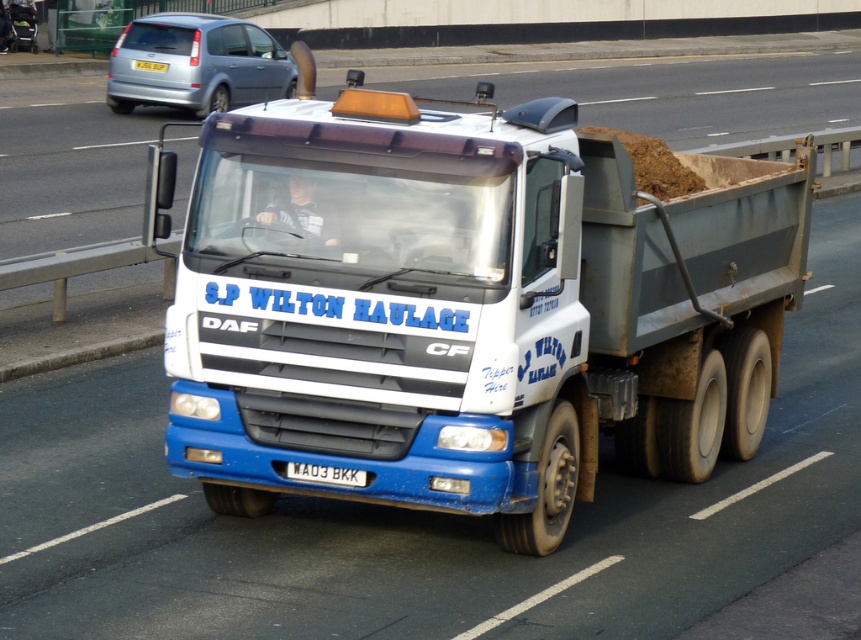
Question: Is white metallic license plate at center in front of white plastic license plate at center?

Choices:
 (A) no
 (B) yes

Answer: (B)

Question: Does blue matte truck at center appear on the right side of metallic silver van at upper left?

Choices:
 (A) no
 (B) yes

Answer: (B)

Question: Among these objects, which one is nearest to the camera?

Choices:
 (A) blue matte truck at center
 (B) white plastic license plate at center
 (C) white metallic license plate at center

Answer: (C)

Question: Does metallic silver van at upper left come behind white metallic license plate at center?

Choices:
 (A) no
 (B) yes

Answer: (B)

Question: Which point appears farthest from the camera in this image?

Choices:
 (A) (164, 68)
 (B) (293, 474)

Answer: (A)

Question: Which point is closer to the camera taking this photo?

Choices:
 (A) (645, 310)
 (B) (299, 472)

Answer: (B)